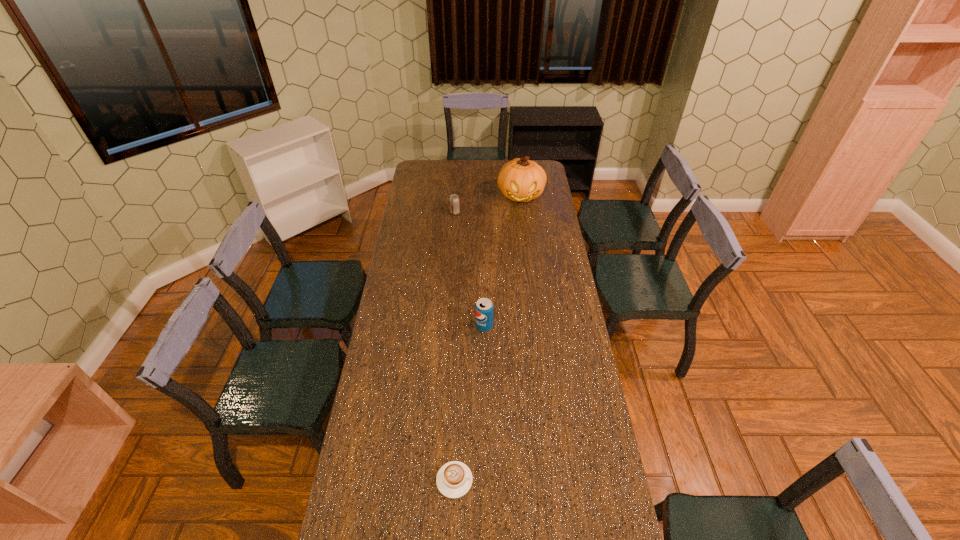
Where is `free point between the shortest object and the third object from left to right`? free point between the shortest object and the third object from left to right is located at coordinates (469, 403).

At what (x,y) coordinates should I click in order to perform the action: click on vacant region between the right soda can and the shortest object. Please return your answer as a coordinate pair (x, y). Looking at the image, I should click on (469, 403).

Where is `free spot between the pumpkin and the nearest object`? The height and width of the screenshot is (540, 960). free spot between the pumpkin and the nearest object is located at coordinates pyautogui.click(x=488, y=338).

Locate an element on the screen. free space between the nearest object and the farthest object is located at coordinates (488, 338).

Locate an element on the screen. Image resolution: width=960 pixels, height=540 pixels. empty space that is in between the right soda can and the third tallest object is located at coordinates (469, 269).

This screenshot has height=540, width=960. Find the location of `unoccupied position between the third object from left to right and the cappuccino`. unoccupied position between the third object from left to right and the cappuccino is located at coordinates click(x=469, y=403).

You are a GUI agent. You are given a task and a screenshot of the screen. Output one action in this format:
    pyautogui.click(x=<x>, y=<y>)
    Task: Click on the vacant space that's between the cappuccino and the farther soda can
    This screenshot has height=540, width=960.
    Given the screenshot: What is the action you would take?
    pyautogui.click(x=455, y=346)

Where is `free point between the nearest object and the farthest object`? free point between the nearest object and the farthest object is located at coordinates (488, 338).

Locate an element on the screen. object that is the nearest to the left soda can is located at coordinates coord(521,180).

Locate an element on the screen. object identified as the closest to the rightmost object is located at coordinates (454, 200).